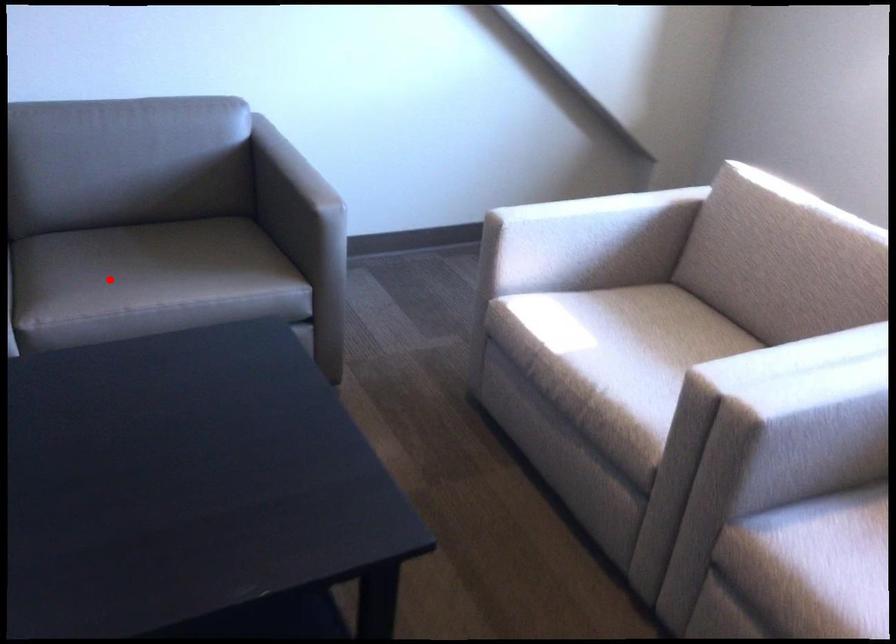
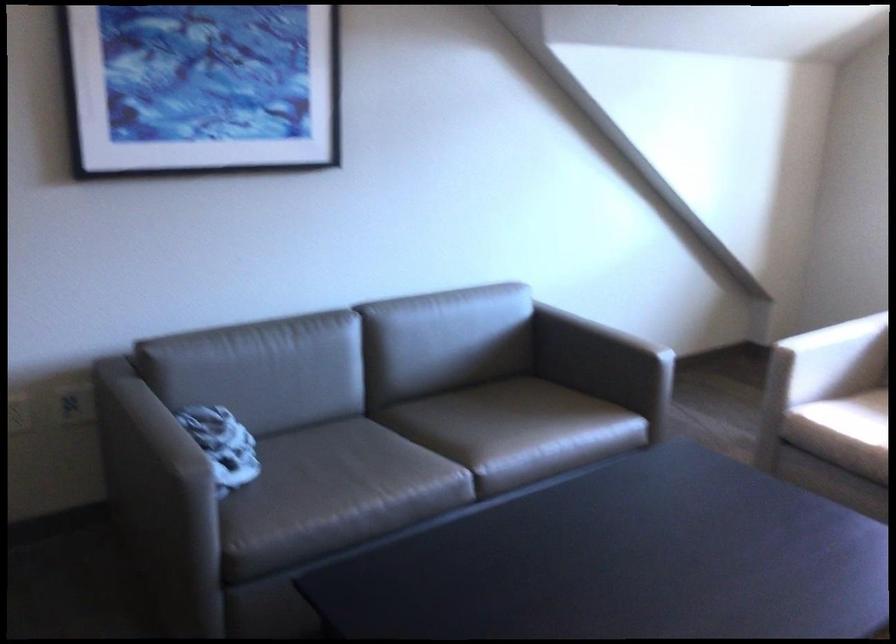
Question: I am providing you with two images of the same scene from different viewpoints. Given a red point in image1, look at the same physical point in image2. Is it:

Choices:
 (A) Closer to the viewpoint
 (B) Farther from the viewpoint

Answer: (B)